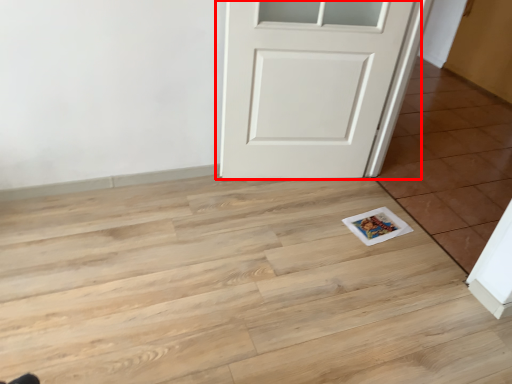
Question: From the image's perspective, where is door (annotated by the red box) located relative to tile?

Choices:
 (A) above
 (B) below

Answer: (A)